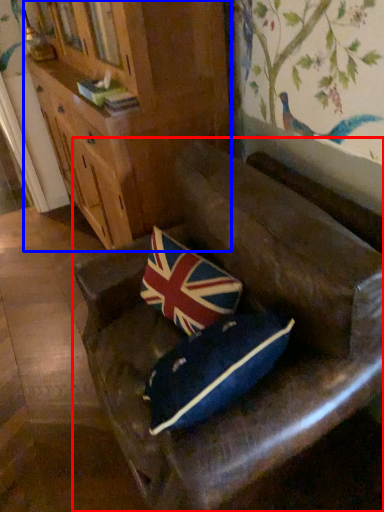
Question: Which point is closer to the camera, furniture (highlighted by a red box) or cabinetry (highlighted by a blue box)?

Choices:
 (A) furniture
 (B) cabinetry

Answer: (A)